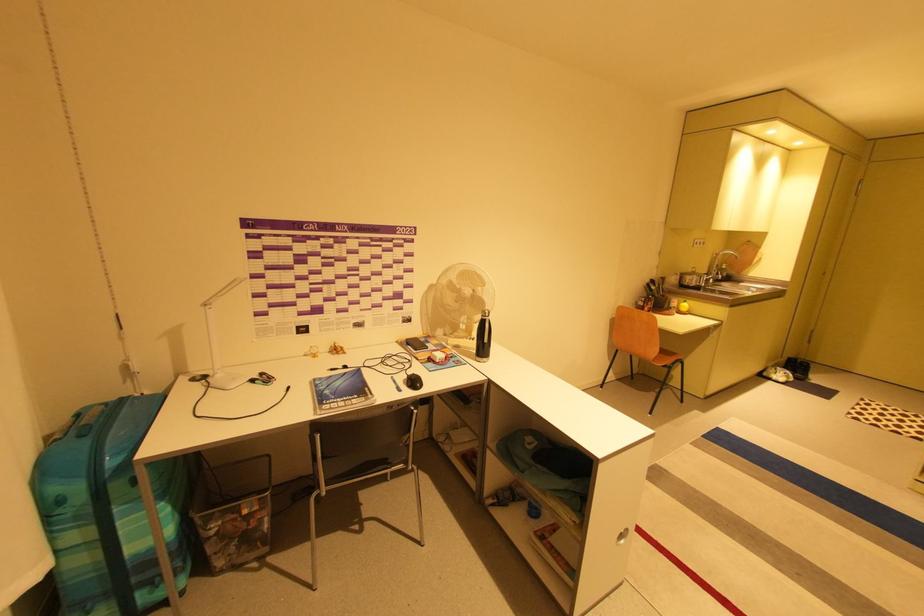
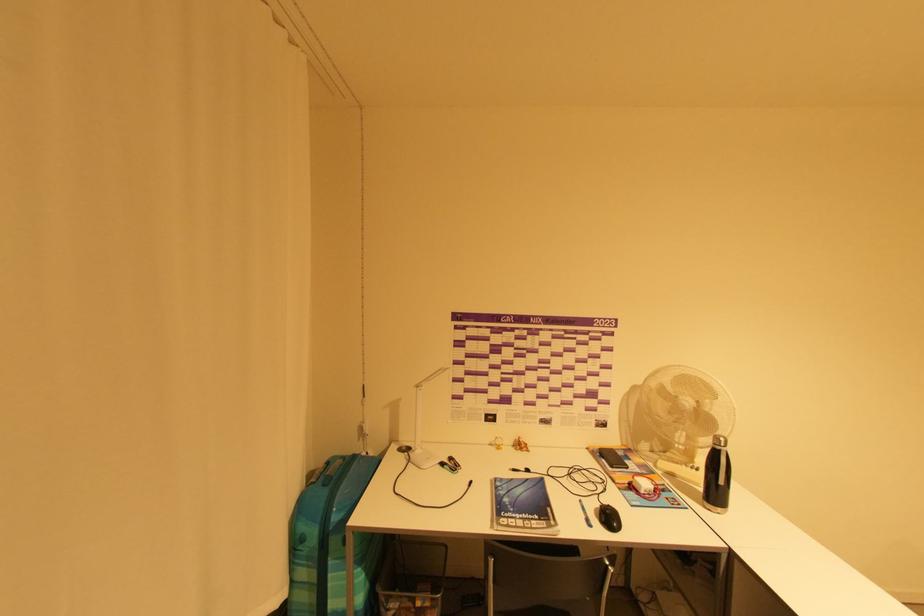
Where in the second image is the point corresponding to the point at 403,391 from the first image?

(592, 525)